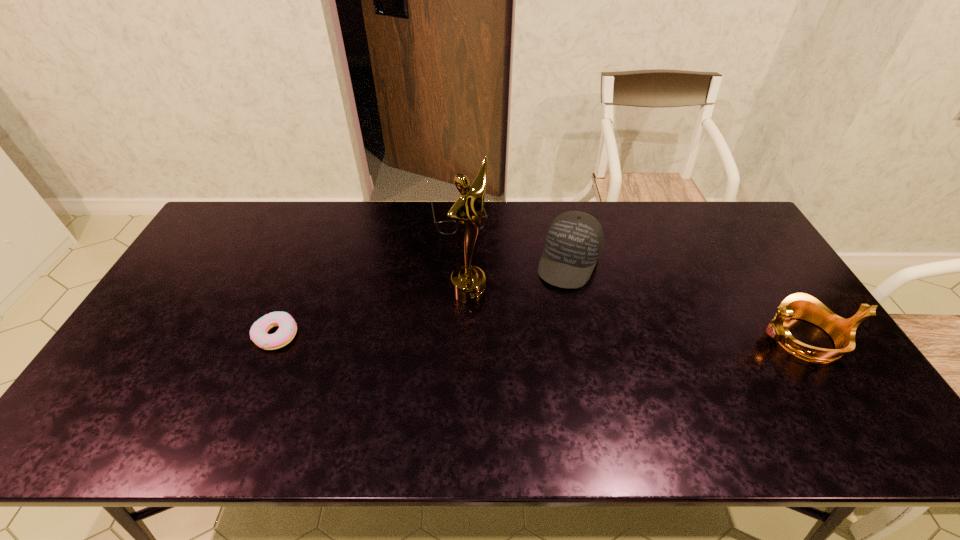
You are a GUI agent. You are given a task and a screenshot of the screen. Output one action in this format:
    pyautogui.click(x=<x>, y=<y>)
    Task: Click on the free space on the desktop that is between the leftmost object and the tiara and is positioned at the front of the second object from right to left where the brim is located
    
    Given the screenshot: What is the action you would take?
    pyautogui.click(x=535, y=336)

Identify the location of vacant space on the desktop that is between the doughnut and the tiara and is positioned on the front-facing side of the farthest object. The image size is (960, 540). (492, 336).

Identify the location of vacant space on the desktop that is between the leftmost object and the tiara and is positioned on the front-facing side of the award. The height and width of the screenshot is (540, 960). (546, 336).